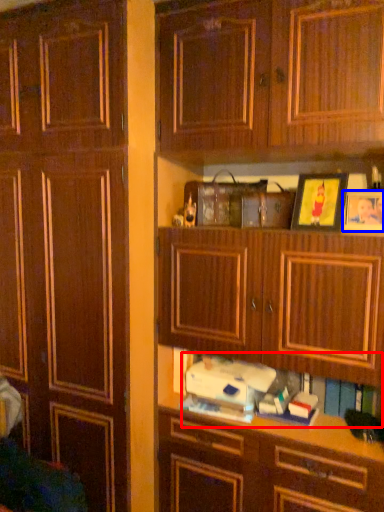
Question: Which point is further to the camera, book (highlighted by a red box) or picture frame (highlighted by a blue box)?

Choices:
 (A) book
 (B) picture frame

Answer: (A)